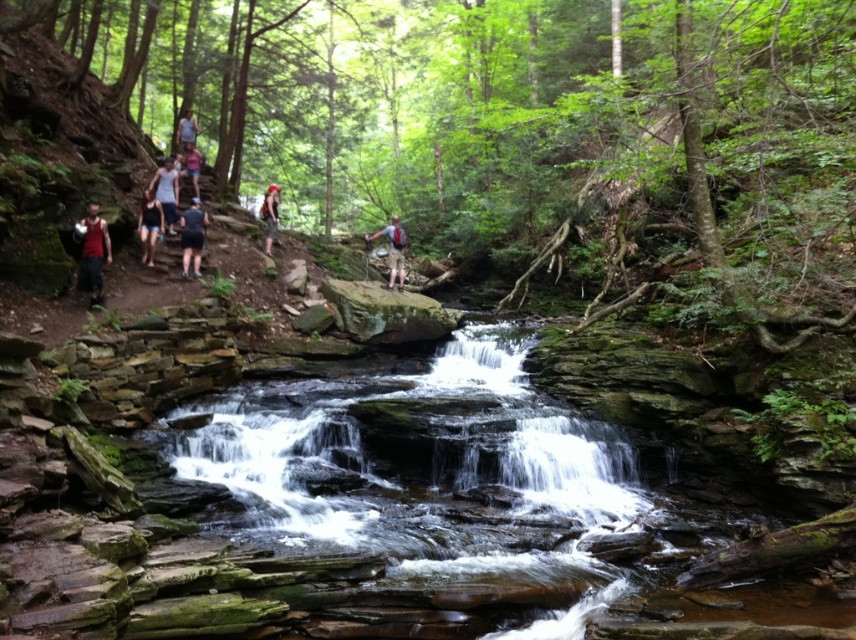
You are a photographer positioned at the base of the waterfall. You notice two light blue items worn by a hiker at the upper center of the scene. Which item appears closer to you, the light blue fabric shirt at upper center or the light blue denim shorts at upper center?

The light blue fabric shirt at upper center appears closer to you because it is further to the viewer than the light blue denim shorts at upper center.

You are a hiker who wants to cross the smooth rock stream at center while wearing the matte black shorts at center. Is the stream wide enough for you to step across without getting your shorts wet?

The smooth rock stream at center is bigger than matte black shorts at center, so yes, the stream is wider than the shorts, allowing you to step across without getting your shorts wet.

You are a photographer planning to take a portrait of the person wearing the light blue fabric shirt at upper center and the light blue denim shorts at upper center. Since you want to focus on their clothing, which clothing item should you zoom in on to capture more detail without cropping the other item out?

The light blue fabric shirt at upper center has a lesser width compared to light blue denim shorts at upper center, so you should zoom in on the light blue denim shorts at upper center to capture more detail without cropping the other item out.